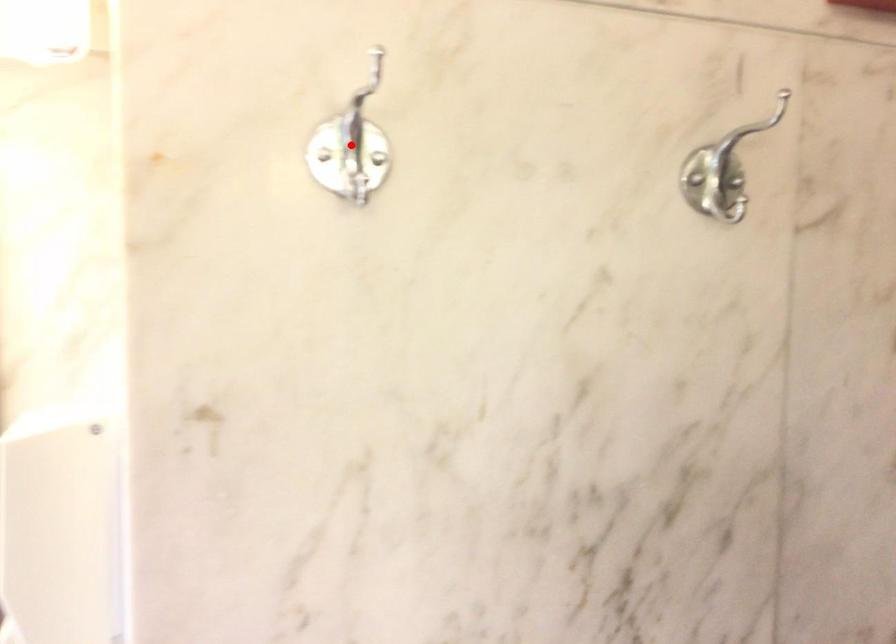
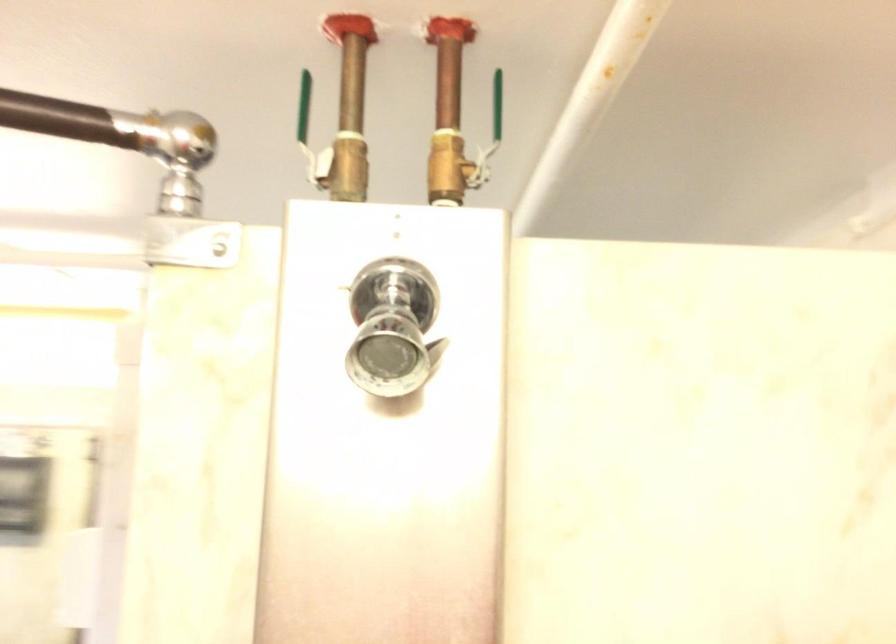
Question: I am providing you with two images of the same scene from different viewpoints. A red point is marked on the first image. At the location where the point appears in image 1, is it still visible in image 2?

Choices:
 (A) Yes
 (B) No

Answer: (B)